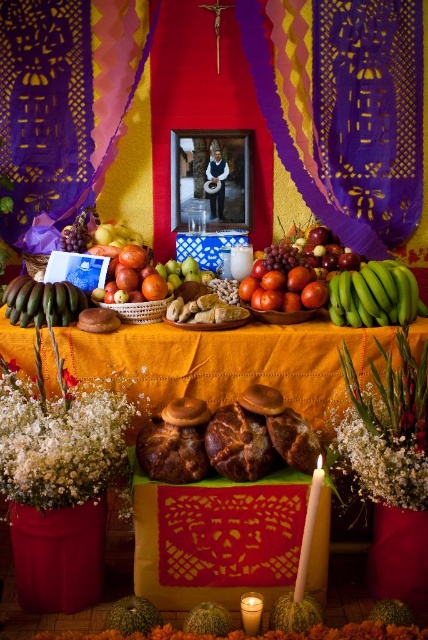
This screenshot has width=428, height=640. What do you see at coordinates (64, 440) in the screenshot?
I see `white fluffy flowers at center` at bounding box center [64, 440].

Find the location of a particular element. white fluffy flowers at center is located at coordinates [64, 440].

Is point (107, 481) less distant than point (41, 296)?

Yes, it is.

The width and height of the screenshot is (428, 640). Find the location of `white fluffy flowers at center`. white fluffy flowers at center is located at coordinates click(x=64, y=440).

Can you confirm if white fluffy flowers at lower center is positioned to the left of white wax candle at center?

Yes, white fluffy flowers at lower center is to the left of white wax candle at center.

Is white fluffy flowers at lower center below white wax candle at center?

Correct, white fluffy flowers at lower center is located below white wax candle at center.

Which is behind, point (368, 636) or point (300, 595)?

Positioned behind is point (300, 595).

Identify the location of white fluffy flowers at lower center. (261, 634).

Is the position of white fluffy flowers at lower center less distant than that of shiny red apples at center?

Yes, white fluffy flowers at lower center is closer to the viewer.

Is point (416, 636) positioned before point (140, 248)?

Yes, point (416, 636) is in front of point (140, 248).

Does point (377, 627) come closer to viewer compared to point (115, 275)?

That is True.

The width and height of the screenshot is (428, 640). I want to click on white fluffy flowers at lower center, so click(x=261, y=634).